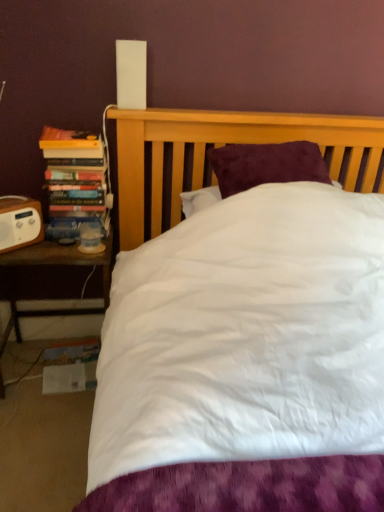
I want to click on vacant area that is in front of hardcover books at left, so pos(62,245).